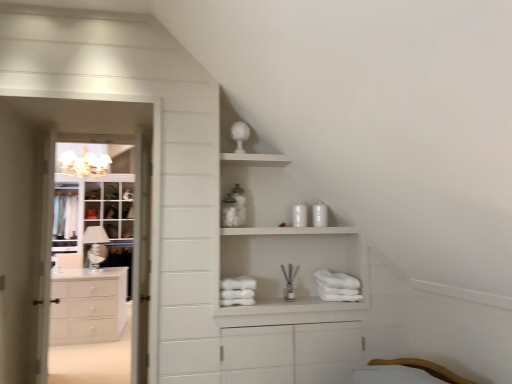
Question: From the image's perspective, would you say white wood door at left is positioned over white glossy cabinet at left?

Choices:
 (A) no
 (B) yes

Answer: (A)

Question: Can you confirm if white wood door at left is thinner than white glossy cabinet at left?

Choices:
 (A) no
 (B) yes

Answer: (A)

Question: Is white wood door at left facing away from white glossy cabinet at left?

Choices:
 (A) yes
 (B) no

Answer: (B)

Question: Is white glossy cabinet at left a part of white wood door at left?

Choices:
 (A) yes
 (B) no

Answer: (B)

Question: Is white wood door at left oriented towards white glossy cabinet at left?

Choices:
 (A) no
 (B) yes

Answer: (B)

Question: From their relative heights in the image, would you say white glossy cabinet at left is taller or shorter than white matte cabinet at upper center?

Choices:
 (A) short
 (B) tall

Answer: (B)

Question: In terms of width, does white glossy cabinet at left look wider or thinner when compared to white matte cabinet at upper center?

Choices:
 (A) thin
 (B) wide

Answer: (A)

Question: Considering their positions, is white glossy cabinet at left located in front of or behind white matte cabinet at upper center?

Choices:
 (A) behind
 (B) front

Answer: (A)

Question: Would you say white glossy cabinet at left is inside or outside white matte cabinet at upper center?

Choices:
 (A) inside
 (B) outside

Answer: (B)

Question: From a real-world perspective, is white matte chest of drawers at left above or below white glass cabinet at left?

Choices:
 (A) above
 (B) below

Answer: (B)

Question: Considering the positions of white matte chest of drawers at left and white glass cabinet at left in the image, is white matte chest of drawers at left bigger or smaller than white glass cabinet at left?

Choices:
 (A) big
 (B) small

Answer: (B)

Question: Is point (70, 329) positioned closer to the camera than point (69, 198)?

Choices:
 (A) closer
 (B) farther

Answer: (A)

Question: Considering the relative positions of white matte chest of drawers at left and white glass cabinet at left in the image provided, is white matte chest of drawers at left to the left or to the right of white glass cabinet at left?

Choices:
 (A) left
 (B) right

Answer: (B)

Question: Does point (x=84, y=243) appear closer or farther from the camera than point (x=316, y=299)?

Choices:
 (A) closer
 (B) farther

Answer: (B)

Question: Is clear glass lamp at left to the left or to the right of white matte cabinet at upper center in the image?

Choices:
 (A) right
 (B) left

Answer: (B)